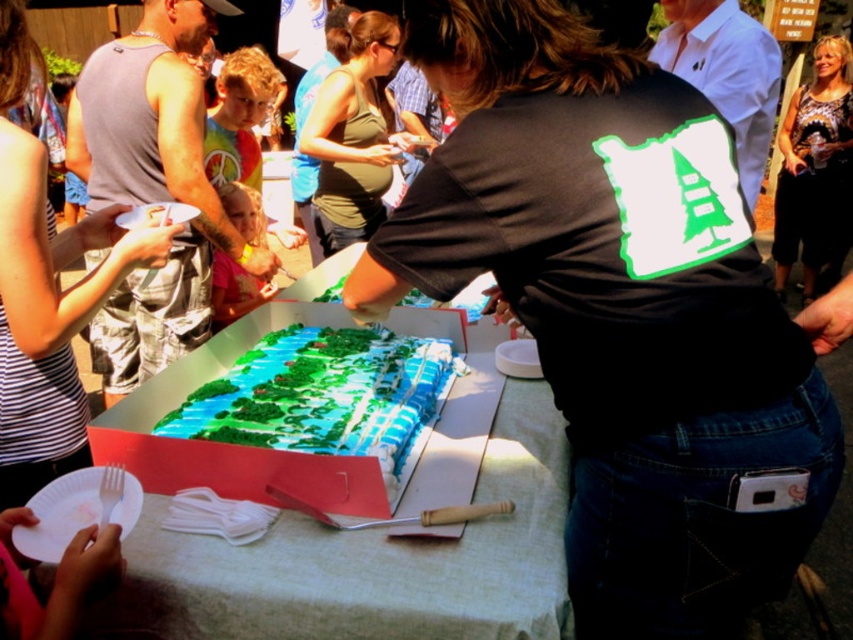
Which is more to the left, white paper plate at center or white paper plate at upper left?

Positioned to the left is white paper plate at upper left.

Which of these two, white paper plate at center or white paper plate at upper left, stands shorter?

With less height is white paper plate at upper left.

The height and width of the screenshot is (640, 853). Identify the location of white paper plate at center. (380, 547).

Is printed fabric blouse at center taller than white paper plate at upper left?

Yes.

Does printed fabric blouse at center have a lesser width compared to white paper plate at upper left?

No.

The height and width of the screenshot is (640, 853). In order to click on printed fabric blouse at center in this screenshot , I will do point(813,166).

The image size is (853, 640). What are the coordinates of `printed fabric blouse at center` in the screenshot? It's located at (813, 166).

Between green matte tank top at center and white paper plate at upper left, which one appears on the left side from the viewer's perspective?

Positioned to the left is white paper plate at upper left.

This screenshot has height=640, width=853. What are the coordinates of `green matte tank top at center` in the screenshot? It's located at (351, 132).